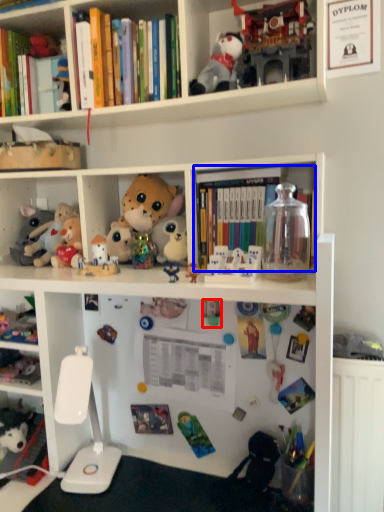
Question: Which object appears farthest to the camera in this image, toy (highlighted by a red box) or book (highlighted by a blue box)?

Choices:
 (A) toy
 (B) book

Answer: (A)